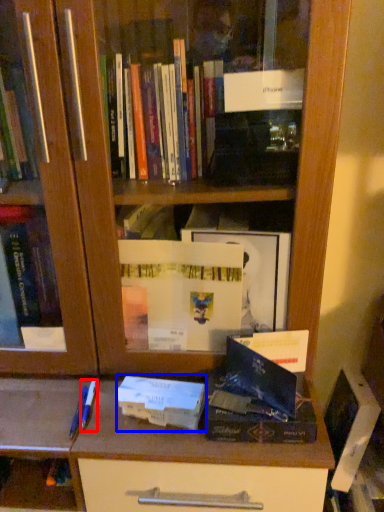
Question: Which object is closer to the camera taking this photo, pen (highlighted by a red box) or paperback book (highlighted by a blue box)?

Choices:
 (A) pen
 (B) paperback book

Answer: (B)